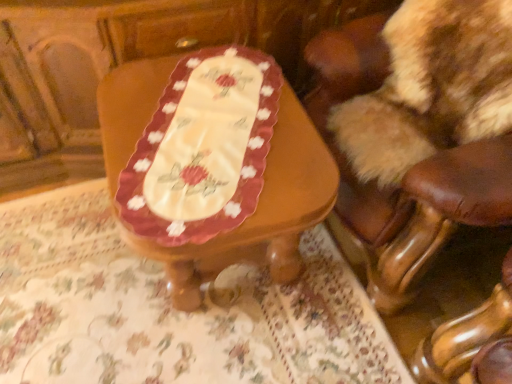
This screenshot has height=384, width=512. What are the coordinates of `free space between brown leather chair at upper right and wooden table at center` in the screenshot? It's located at (302, 320).